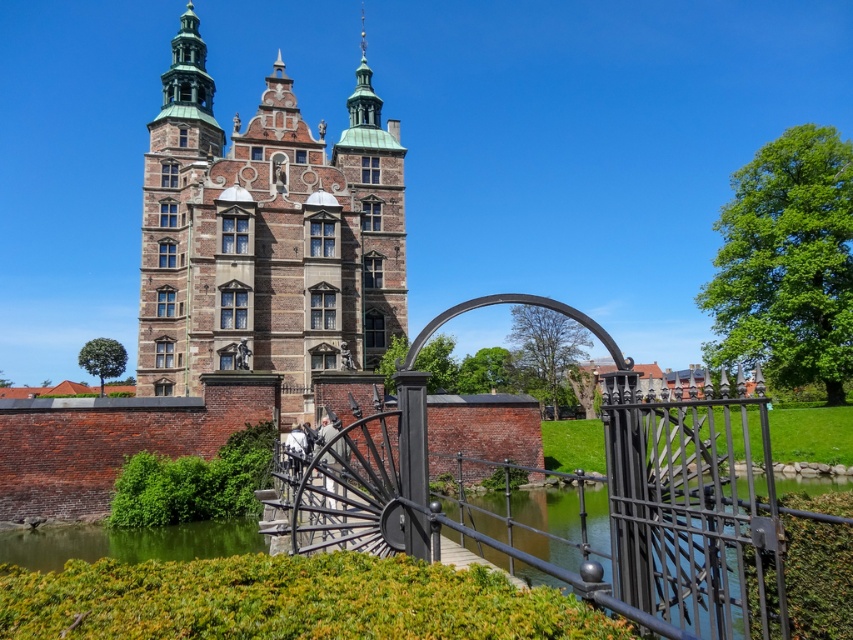
You are a visitor approaching the black metal gate at the entrance. From your perspective, which object, the brown brick church at upper left or the green water at lower left, appears to be closer to you?

The green water at lower left appears closer because it is positioned lower in the image, which typically indicates proximity in visual perspective.

You are a delivery person with a large cart that is 2 meters wide. You need to pass through the entrance to deliver packages to the historic building. Can your cart fit through the black wrought iron gate at center without going into the green water at lower left?

The black wrought iron gate at center might be wider than green water at lower left, so there is a possibility that the gate is wide enough for the cart to pass through without entering the water. However, since the exact width isn t confirmed, it s advisable to check the actual dimensions before proceeding.